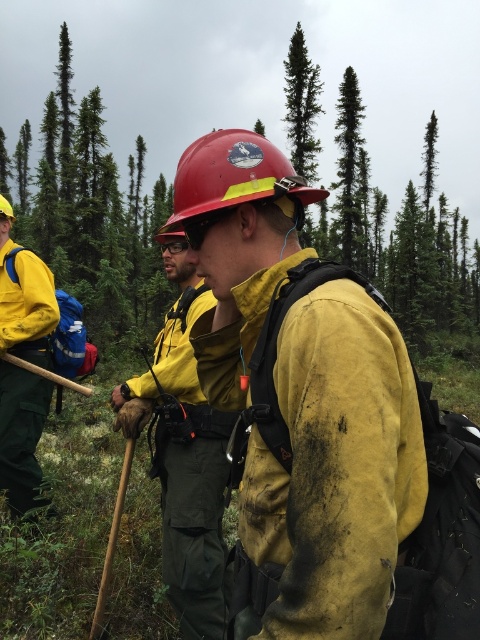
Who is lower down, green leafy tree at upper left or green rough bark tree at upper center?

green rough bark tree at upper center is below.

The height and width of the screenshot is (640, 480). What do you see at coordinates (91, 212) in the screenshot?
I see `green leafy tree at upper left` at bounding box center [91, 212].

Does point (98, 184) come in front of point (351, 88)?

Yes, it is in front of point (351, 88).

You are a GUI agent. You are given a task and a screenshot of the screen. Output one action in this format:
    pyautogui.click(x=<x>, y=<y>)
    Task: Click on the green leafy tree at upper left
    
    Given the screenshot: What is the action you would take?
    pyautogui.click(x=91, y=212)

Who is positioned more to the right, matte yellow jacket at center or green leafy tree at center?

From the viewer's perspective, green leafy tree at center appears more on the right side.

Who is higher up, matte yellow jacket at center or green leafy tree at center?

green leafy tree at center

Find the location of a particular element. matte yellow jacket at center is located at coordinates click(335, 470).

Does green rough bark tree at upper center appear on the left side of matte yellow helmet at center?

In fact, green rough bark tree at upper center is to the right of matte yellow helmet at center.

Which is more to the right, green rough bark tree at upper center or matte yellow helmet at center?

green rough bark tree at upper center is more to the right.

The height and width of the screenshot is (640, 480). What are the coordinates of `green rough bark tree at upper center` in the screenshot? It's located at (349, 172).